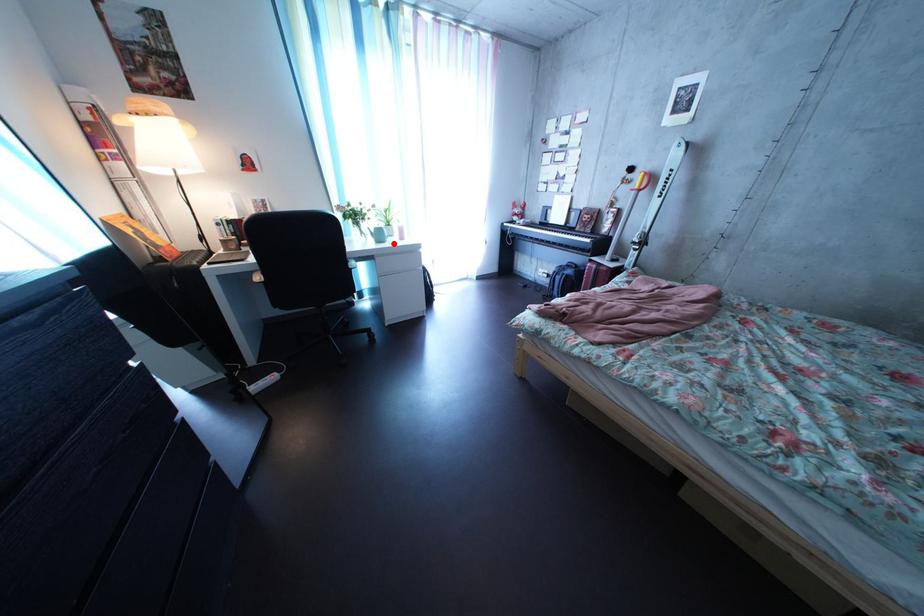
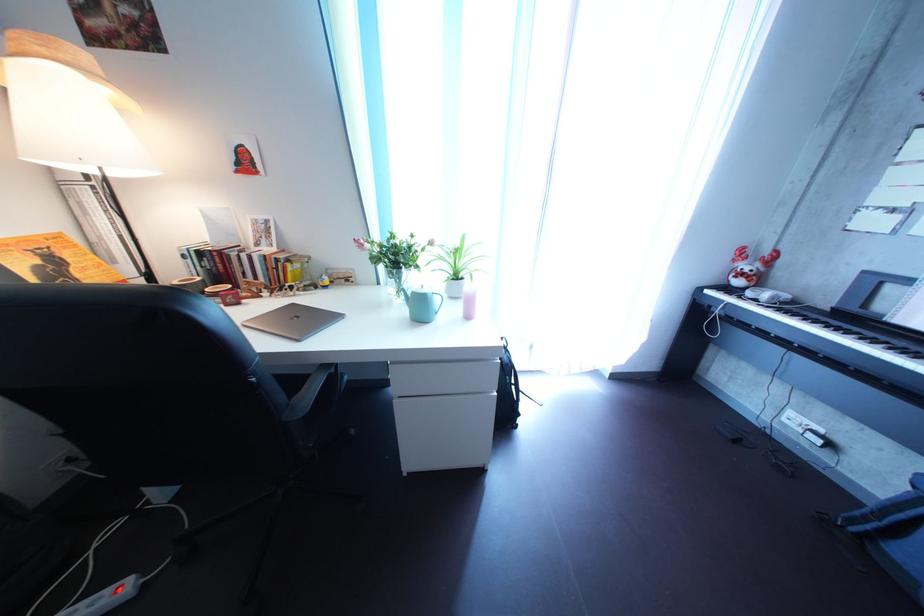
In the second image, find the point that corresponds to the highlighted location in the first image.

(433, 315)